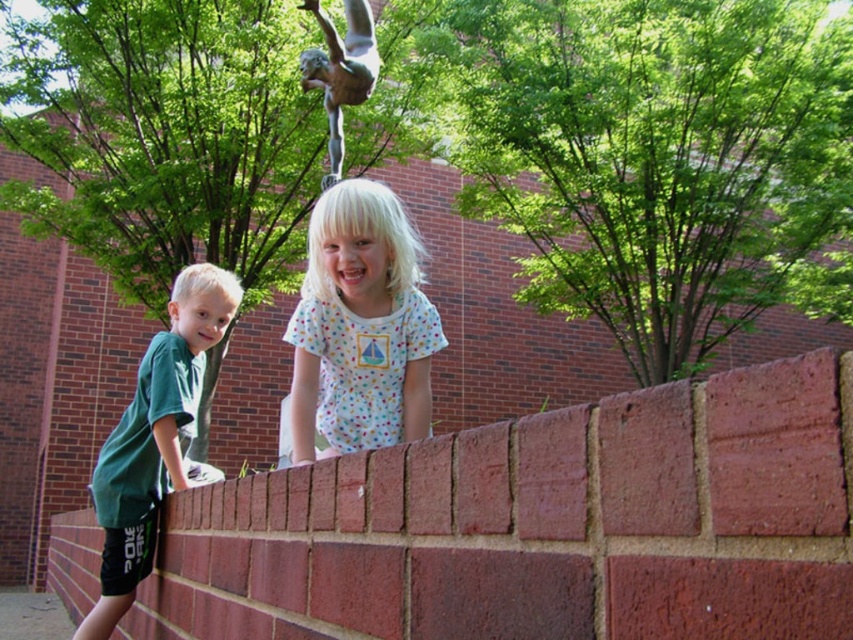
Does brick wall at center appear on the left side of green patina statue at upper center?

No, brick wall at center is not to the left of green patina statue at upper center.

Can you confirm if brick wall at center is bigger than green patina statue at upper center?

Indeed, brick wall at center has a larger size compared to green patina statue at upper center.

What do you see at coordinates (543, 525) in the screenshot? The width and height of the screenshot is (853, 640). I see `brick wall at center` at bounding box center [543, 525].

You are a GUI agent. You are given a task and a screenshot of the screen. Output one action in this format:
    pyautogui.click(x=<x>, y=<y>)
    Task: Click on the brick wall at center
    The height and width of the screenshot is (640, 853).
    Given the screenshot: What is the action you would take?
    pyautogui.click(x=543, y=525)

Between point (427, 317) and point (170, 484), which one is positioned in front?

Point (427, 317) is more forward.

Between white dotted shirt at center and green matte shirt at left, which one is positioned higher?

white dotted shirt at center

Who is more forward, [329,304] or [135,476]?

Point [329,304] is more forward.

Find the location of a particular element. white dotted shirt at center is located at coordinates pyautogui.click(x=360, y=326).

Does white dotted shirt at center have a greater height compared to green patina statue at upper center?

Incorrect, white dotted shirt at center's height is not larger of green patina statue at upper center's.

Can you confirm if white dotted shirt at center is wider than green patina statue at upper center?

Yes, white dotted shirt at center is wider than green patina statue at upper center.

The width and height of the screenshot is (853, 640). In order to click on white dotted shirt at center in this screenshot , I will do `click(360, 326)`.

The height and width of the screenshot is (640, 853). I want to click on white dotted shirt at center, so click(x=360, y=326).